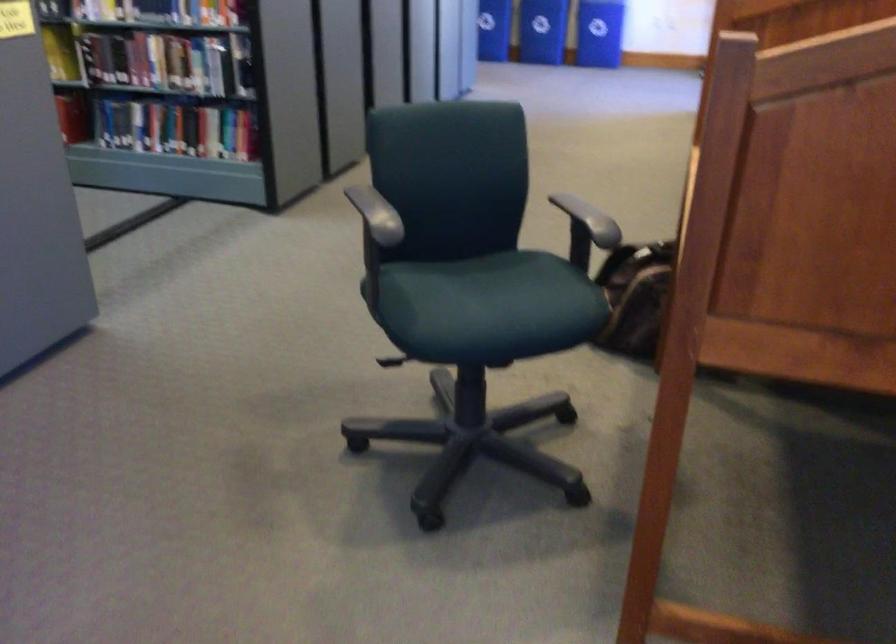
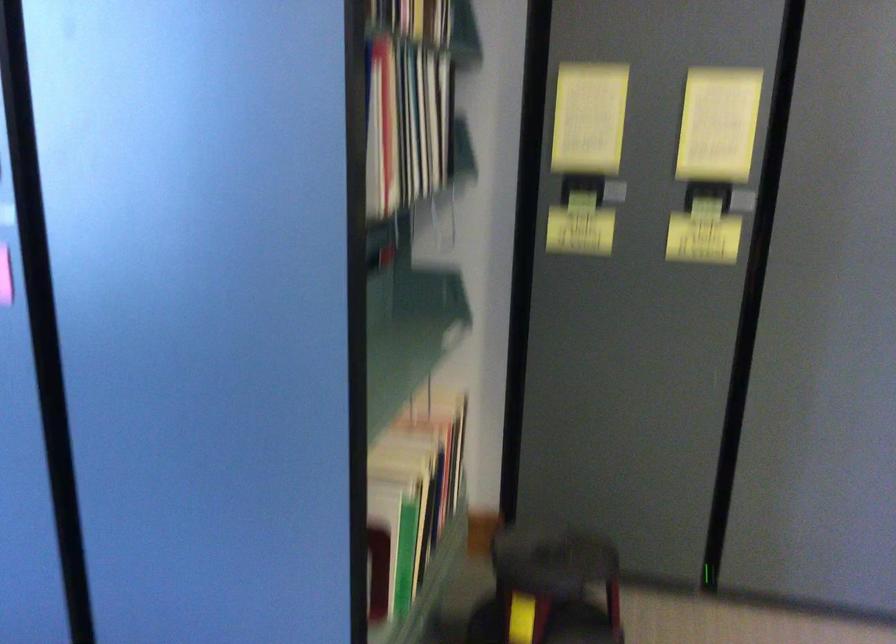
Question: How did the camera likely rotate?

Choices:
 (A) Left
 (B) Right
 (C) Up
 (D) Down

Answer: (A)